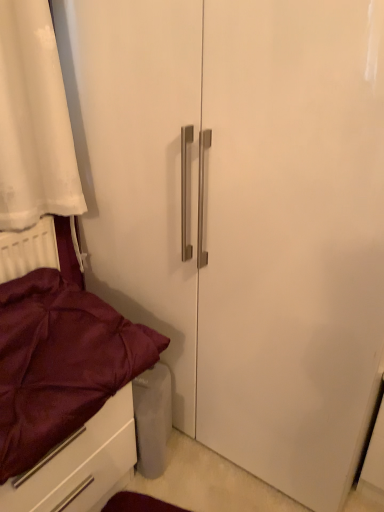
Question: Relative to maroon satin bed at lower left, is satin burgundy drawer at lower left in front or behind?

Choices:
 (A) behind
 (B) front

Answer: (A)

Question: From the image's perspective, is satin burgundy drawer at lower left positioned above or below maroon satin bed at lower left?

Choices:
 (A) above
 (B) below

Answer: (B)

Question: Considering the relative positions of satin burgundy drawer at lower left and maroon satin bed at lower left in the image provided, is satin burgundy drawer at lower left to the left or to the right of maroon satin bed at lower left?

Choices:
 (A) left
 (B) right

Answer: (A)

Question: Looking at their shapes, would you say maroon satin bed at lower left is wider or thinner than satin burgundy drawer at lower left?

Choices:
 (A) thin
 (B) wide

Answer: (B)

Question: Is point (82, 474) positioned closer to the camera than point (129, 388)?

Choices:
 (A) closer
 (B) farther

Answer: (A)

Question: Would you say maroon satin bed at lower left is to the left or to the right of satin burgundy drawer at lower left in the picture?

Choices:
 (A) left
 (B) right

Answer: (B)

Question: Which is correct: maroon satin bed at lower left is inside satin burgundy drawer at lower left, or outside of it?

Choices:
 (A) outside
 (B) inside

Answer: (A)